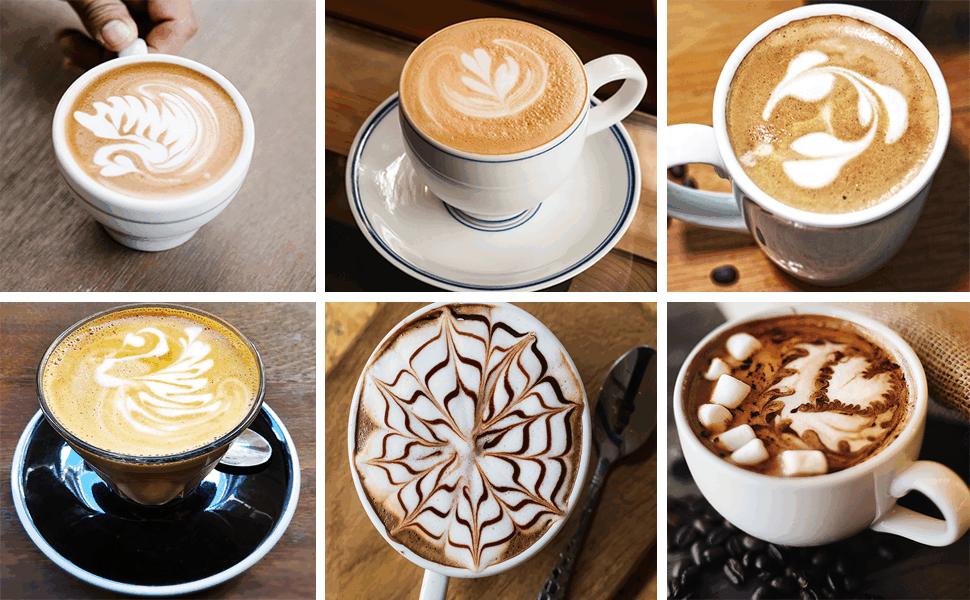
Locate an element on the screen. The height and width of the screenshot is (600, 970). coffee cups is located at coordinates point(185,204), point(468,174), point(812,220), point(876,327), point(400,322), point(174,469).